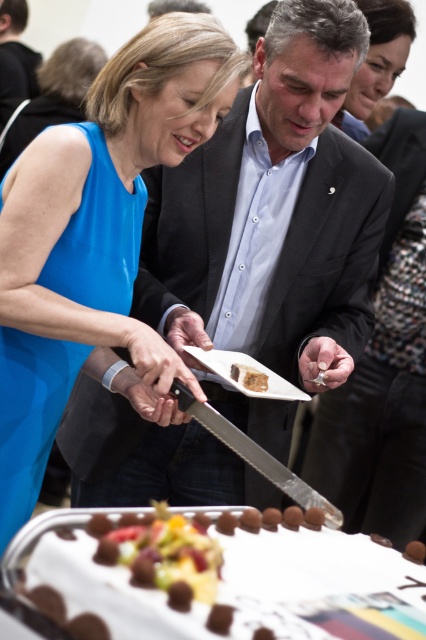
Question: Is matte black suit at center smaller than silver metallic knife at center?

Choices:
 (A) yes
 (B) no

Answer: (B)

Question: Among these objects, which one is nearest to the camera?

Choices:
 (A) blue silk dress at upper left
 (B) white chocolate truffle at lower center
 (C) white cream cake with chocolate truffles at center
 (D) silver metallic knife at center

Answer: (C)

Question: Is the position of matte black suit at center less distant than that of brown crumbly cake at center?

Choices:
 (A) no
 (B) yes

Answer: (B)

Question: Is matte black dress at upper center behind brown crumbly cake at center?

Choices:
 (A) no
 (B) yes

Answer: (B)

Question: Which object is the closest to the silver metallic knife at center?

Choices:
 (A) blue silk dress at upper left
 (B) brown crumbly cake at center
 (C) white chocolate truffle at lower center
 (D) matte black suit at center

Answer: (B)

Question: Which point is closer to the camera?

Choices:
 (A) (396, 13)
 (B) (31, 481)
 (C) (287, 268)

Answer: (B)